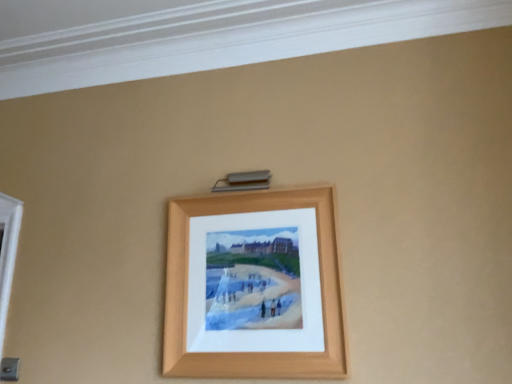
The width and height of the screenshot is (512, 384). Describe the element at coordinates (252, 352) in the screenshot. I see `wooden picture frame at upper center` at that location.

Where is `wooden picture frame at upper center`? This screenshot has height=384, width=512. wooden picture frame at upper center is located at coordinates (252, 352).

Measure the distance between wooden picture frame at upper center and camera.

wooden picture frame at upper center and camera are 4.57 feet apart.

What is the approximate height of wooden picture frame at upper center?

wooden picture frame at upper center is 68.08 centimeters in height.

You are a GUI agent. You are given a task and a screenshot of the screen. Output one action in this format:
    pyautogui.click(x=<x>, y=<y>)
    Task: Click on the wooden picture frame at upper center
    The image size is (512, 384).
    Given the screenshot: What is the action you would take?
    pyautogui.click(x=252, y=352)